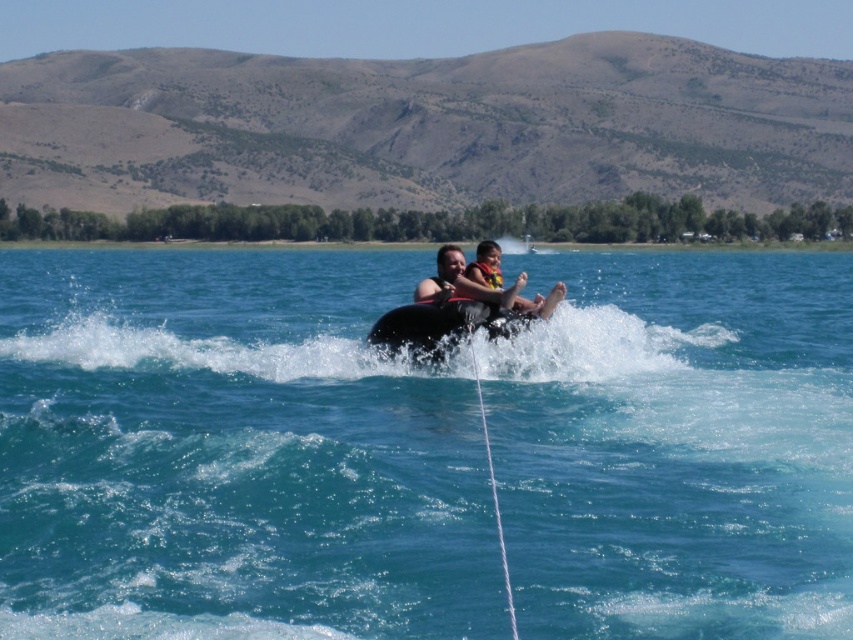
You are a lifeguard on duty and need to ensure the safety of two people wearing life vests. You see the matte black life vest at center and the yellow fabric life jacket at center. Based on the distance between them, can you determine if they are close enough to assist each other in case of an emergency?

The matte black life vest at center and yellow fabric life jacket at center are 69.89 centimeters apart from each other, so they are close enough to assist each other in case of an emergency.

You are a photographer positioned at the edge of the lake. You want to capture a photo where the clear blue water at center is visible behind the matte black life vest at center. Is this possible based on their current positions?

The clear blue water at center is in front of the matte black life vest at center, so it cannot be seen behind it. To achieve this, the positions would need to be adjusted so the water is behind the life vest.